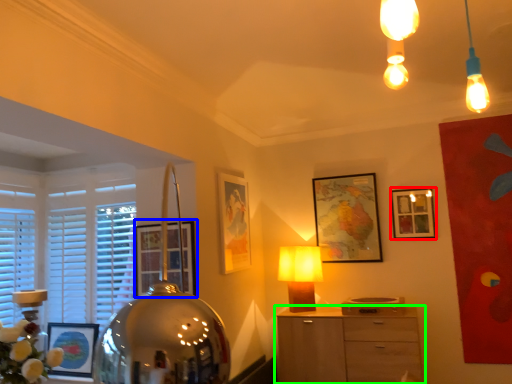
Question: Considering the real-world distances, which object is closest to picture frame (highlighted by a red box)? picture frame (highlighted by a blue box) or chest of drawers (highlighted by a green box).

Choices:
 (A) picture frame
 (B) chest of drawers

Answer: (B)